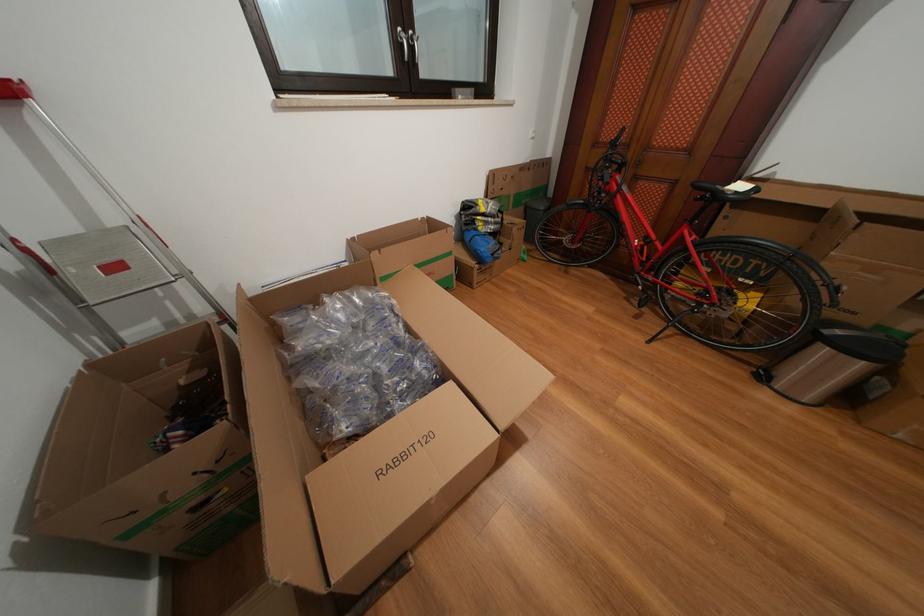
Find the location of a particular element. The width and height of the screenshot is (924, 616). red bicycle handlebar is located at coordinates (616, 140).